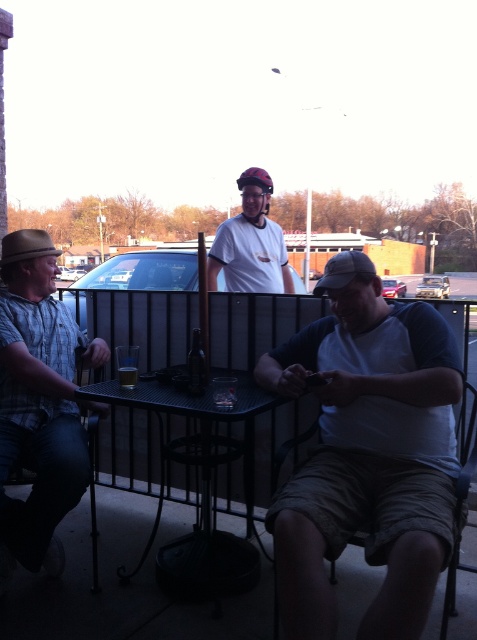
Measure the distance between matte white helmet at center and tan fabric chair at lower right.

1.75 meters

Who is more forward, (225, 268) or (475, 388)?

Positioned in front is point (475, 388).

What do you see at coordinates (250, 243) in the screenshot?
I see `matte white helmet at center` at bounding box center [250, 243].

The width and height of the screenshot is (477, 640). Find the location of `matte white helmet at center`. matte white helmet at center is located at coordinates (250, 243).

Does white cotton shirt at center appear over tan fabric chair at lower right?

Yes.

Is white cotton shirt at center closer to camera compared to tan fabric chair at lower right?

That is True.

Between point (317, 518) and point (470, 433), which one is positioned in front?

Point (317, 518)

Where is `white cotton shirt at center`? The width and height of the screenshot is (477, 640). white cotton shirt at center is located at coordinates (367, 452).

Does white cotton shirt at center come in front of plaid shirt at left?

Yes, white cotton shirt at center is in front of plaid shirt at left.

Does white cotton shirt at center have a smaller size compared to plaid shirt at left?

Incorrect, white cotton shirt at center is not smaller in size than plaid shirt at left.

What do you see at coordinates (367, 452) in the screenshot? The width and height of the screenshot is (477, 640). I see `white cotton shirt at center` at bounding box center [367, 452].

I want to click on white cotton shirt at center, so click(367, 452).